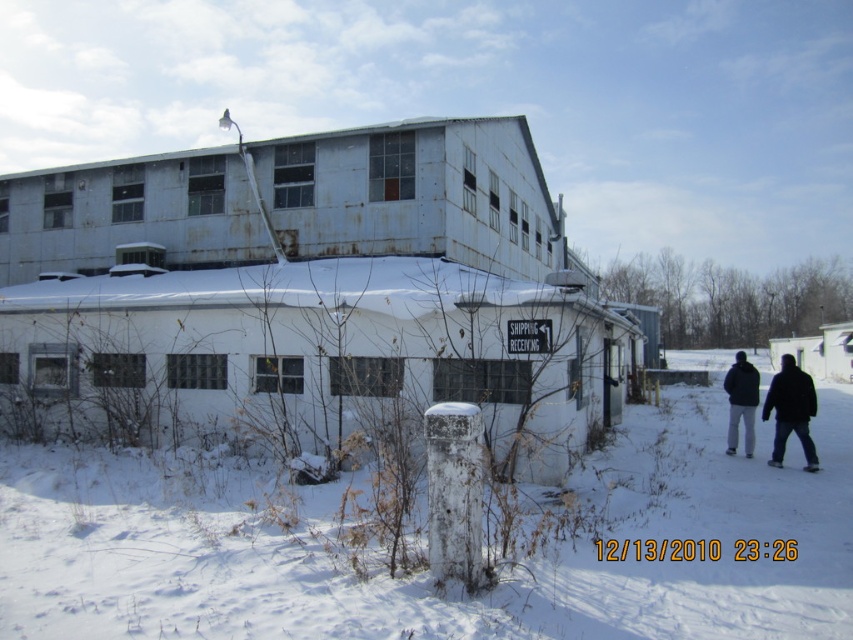
Between dark gray jacket at lower right and black matte jacket at lower right, which one is positioned lower?

Positioned lower is dark gray jacket at lower right.

Is dark gray jacket at lower right positioned before black matte jacket at lower right?

Yes.

Is point (793, 428) behind point (746, 442)?

No, it is in front of (746, 442).

Locate an element on the screen. This screenshot has width=853, height=640. dark gray jacket at lower right is located at coordinates (791, 410).

Between white powdery snow at center and black matte jacket at lower right, which one is positioned lower?

white powdery snow at center is below.

Is point (170, 512) positioned in front of point (757, 388)?

That is True.

Where is `white powdery snow at center`? Image resolution: width=853 pixels, height=640 pixels. white powdery snow at center is located at coordinates (426, 573).

Consider the image. Measure the distance between white powdery snow at center and camera.

They are 17.57 feet apart.

Which is more to the right, white powdery snow at center or dark gray jacket at lower right?

dark gray jacket at lower right

Is point (61, 588) less distant than point (799, 424)?

Yes, point (61, 588) is closer to viewer.

Locate an element on the screen. The image size is (853, 640). white powdery snow at center is located at coordinates (426, 573).